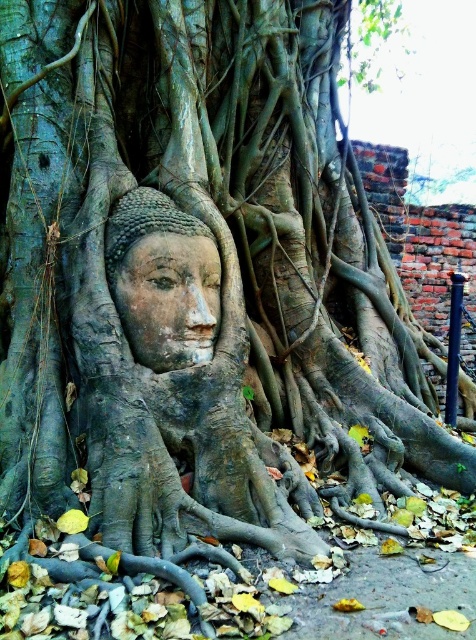
You are an archaeologist examining the image. You need to locate the gray stone buddha head at center. What are its coordinates in the image?

The gray stone buddha head at center is located at coordinates point (180, 403).

Based on the scene description, which object is closer to the viewer between the gray stone buddha head at center and the matte stone face at center?

The gray stone buddha head at center is closer to the viewer than the matte stone face at center.

You are an archaeologist examining the image of the gray stone buddha head at center and the matte stone face at center. Which object is located to the right side of the other?

The gray stone buddha head at center is positioned on the right side of matte stone face at center.